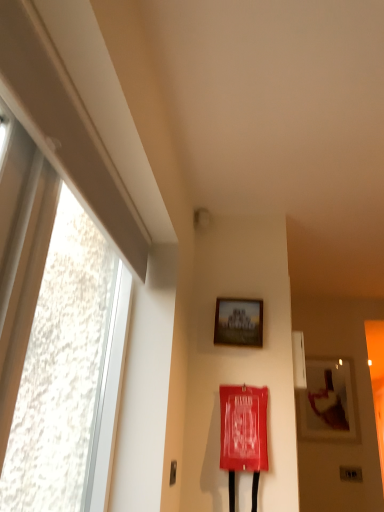
Question: Is wooden picture frame at upper right, acting as the first picture frame starting from the back, taller or shorter than metallic silver door handle at lower left?

Choices:
 (A) short
 (B) tall

Answer: (B)

Question: Is wooden picture frame at upper right, which is the 2th picture frame from front to back, to the left or to the right of metallic silver door handle at lower left in the image?

Choices:
 (A) left
 (B) right

Answer: (B)

Question: Which is farther from the matte wooden picture frame at upper center, the first picture frame from the top?

Choices:
 (A) wooden picture frame at upper right, acting as the first picture frame starting from the right
 (B) transparent glass window at left
 (C) metallic silver door handle at lower left

Answer: (A)

Question: Estimate the real-world distances between objects in this image. Which object is farther from the transparent glass window at left?

Choices:
 (A) wooden picture frame at upper right, which appears as the second picture frame when viewed from the top
 (B) matte wooden picture frame at upper center, which is the 1th picture frame from front to back
 (C) metallic silver door handle at lower left

Answer: (A)